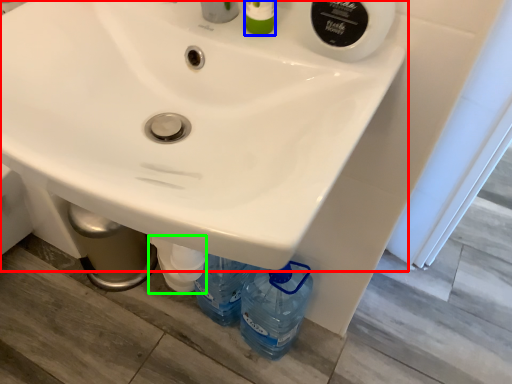
Question: Considering the real-world distances, which object is farthest from sink (highlighted by a red box)? toiletry (highlighted by a blue box) or bottle (highlighted by a green box)?

Choices:
 (A) toiletry
 (B) bottle

Answer: (B)